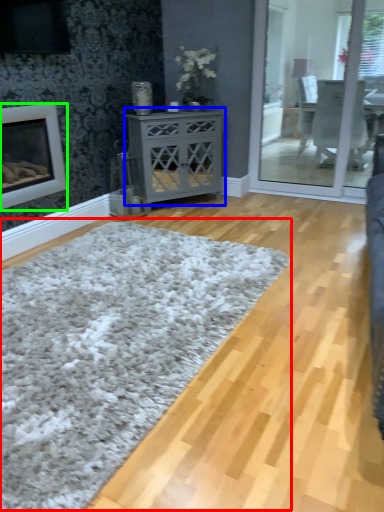
Question: Based on their relative distances, which object is nearer to plain (highlighted by a red box)? Choose from nightstand (highlighted by a blue box) and fireplace (highlighted by a green box).

Choices:
 (A) nightstand
 (B) fireplace

Answer: (B)